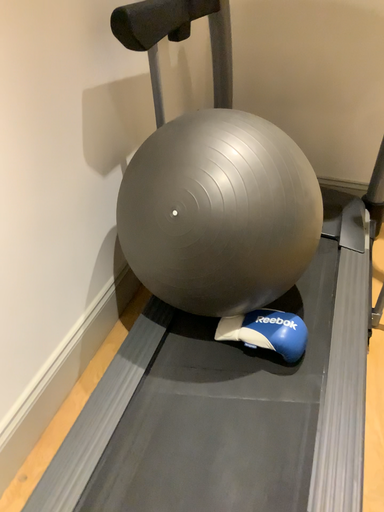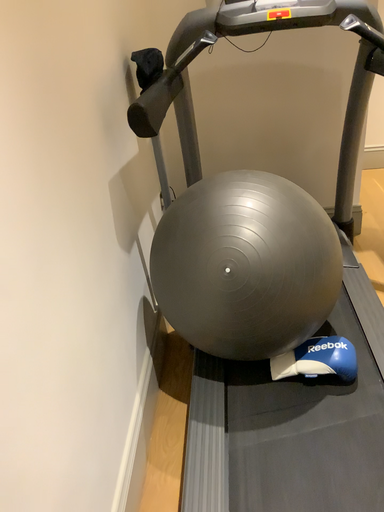
Question: How did the camera likely rotate when shooting the video?

Choices:
 (A) rotated upward
 (B) rotated downward

Answer: (A)